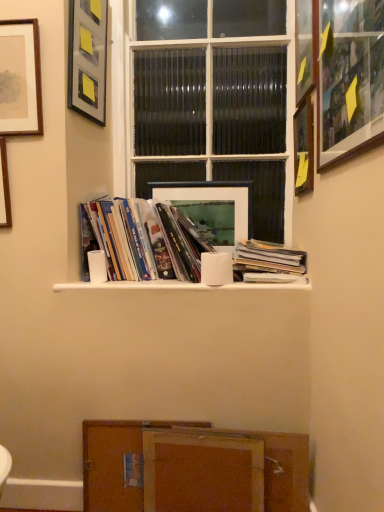
Question: Is wooden picture frame at upper right, the third picture frame from the right, smaller than matte paper stack of books at center, which is the 1th book in right-to-left order?

Choices:
 (A) no
 (B) yes

Answer: (A)

Question: Is matte paper stack of books at center, which is the 1th book in right-to-left order, located within wooden picture frame at upper right, which appears as the fifth picture frame when viewed from the left?

Choices:
 (A) no
 (B) yes

Answer: (A)

Question: Is wooden picture frame at upper right, which appears as the fifth picture frame when viewed from the left, shorter than matte paper stack of books at center, arranged as the 2th book when viewed from the left?

Choices:
 (A) yes
 (B) no

Answer: (B)

Question: Does wooden picture frame at upper right, which appears as the fifth picture frame when viewed from the left, come behind matte paper stack of books at center, which is the 1th book in right-to-left order?

Choices:
 (A) no
 (B) yes

Answer: (A)

Question: Does wooden picture frame at upper right, the third picture frame from the right, come in front of matte paper stack of books at center, which is the 1th book in right-to-left order?

Choices:
 (A) yes
 (B) no

Answer: (A)

Question: From the image's perspective, relative to wooden picture frame at upper right, positioned as the second picture frame in right-to-left order, is matte paper stack of books at center, which is the 1th book in right-to-left order, above or below?

Choices:
 (A) above
 (B) below

Answer: (B)

Question: Looking at their shapes, would you say matte paper stack of books at center, which is the 1th book in right-to-left order, is wider or thinner than wooden picture frame at upper right, which is the 6th picture frame in left-to-right order?

Choices:
 (A) thin
 (B) wide

Answer: (B)

Question: Is matte paper stack of books at center, which is the 1th book in right-to-left order, inside or outside of wooden picture frame at upper right, positioned as the second picture frame in right-to-left order?

Choices:
 (A) outside
 (B) inside

Answer: (A)

Question: From a real-world perspective, is matte paper stack of books at center, which is the 1th book in right-to-left order, positioned above or below wooden picture frame at upper right, which is the 6th picture frame in left-to-right order?

Choices:
 (A) below
 (B) above

Answer: (A)

Question: In the image, is white matte shelf at center on the left side or the right side of wooden picture frame at left, which ranks as the 1th picture frame in left-to-right order?

Choices:
 (A) left
 (B) right

Answer: (B)

Question: Does point (238, 284) appear closer or farther from the camera than point (8, 219)?

Choices:
 (A) closer
 (B) farther

Answer: (A)

Question: From a real-world perspective, is white matte shelf at center physically located above or below wooden picture frame at left, which ranks as the 1th picture frame in left-to-right order?

Choices:
 (A) below
 (B) above

Answer: (A)

Question: Is white matte shelf at center spatially inside wooden picture frame at left, which ranks as the 1th picture frame in left-to-right order, or outside of it?

Choices:
 (A) outside
 (B) inside

Answer: (A)

Question: From the image's perspective, is wooden picture frame at upper right, the first picture frame positioned from the right, located above or below metallic gray picture frame at upper left, which is counted as the fifth picture frame, starting from the right?

Choices:
 (A) above
 (B) below

Answer: (B)

Question: Is wooden picture frame at upper right, which is counted as the seventh picture frame, starting from the left, in front of or behind metallic gray picture frame at upper left, which is counted as the fifth picture frame, starting from the right, in the image?

Choices:
 (A) behind
 (B) front

Answer: (B)